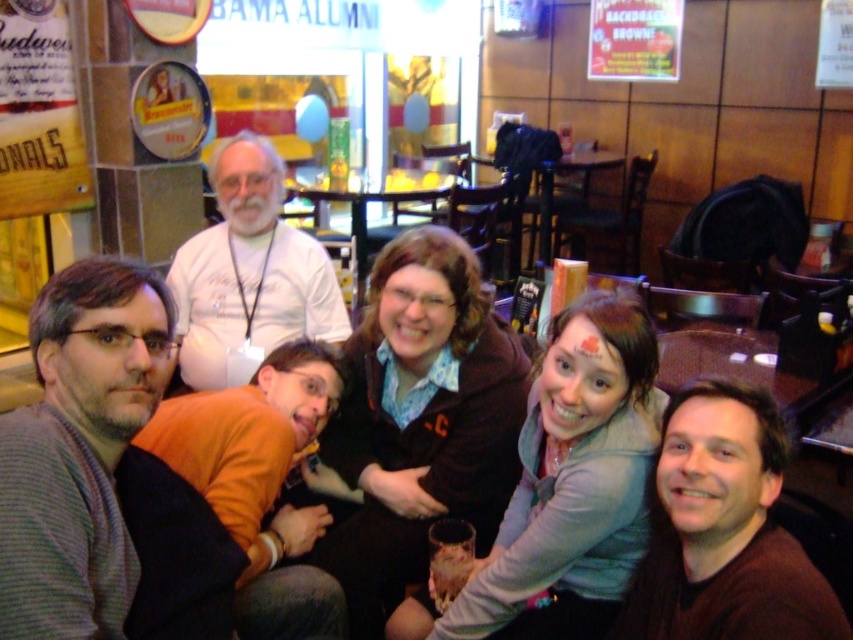
Can you confirm if light gray sweater at center is positioned below white t-shirt at upper left?

Yes, light gray sweater at center is below white t-shirt at upper left.

Between light gray sweater at center and white t-shirt at upper left, which one is positioned lower?

Positioned lower is light gray sweater at center.

Is point (590, 456) farther from camera compared to point (219, 168)?

No, it is in front of (219, 168).

The height and width of the screenshot is (640, 853). Find the location of `light gray sweater at center`. light gray sweater at center is located at coordinates (567, 486).

Describe the element at coordinates (421, 419) in the screenshot. I see `matte black jacket at center` at that location.

Who is positioned more to the left, matte black jacket at center or orange fleece at lower left?

orange fleece at lower left is more to the left.

You are a GUI agent. You are given a task and a screenshot of the screen. Output one action in this format:
    pyautogui.click(x=<x>, y=<y>)
    Task: Click on the matte black jacket at center
    The height and width of the screenshot is (640, 853).
    Given the screenshot: What is the action you would take?
    pyautogui.click(x=421, y=419)

Is orange fleece at lower left above white t-shirt at upper left?

No.

Measure the distance between point (299, 440) and camera.

A distance of 1.95 meters exists between point (299, 440) and camera.

Identify the location of orange fleece at lower left. This screenshot has height=640, width=853. tap(262, 483).